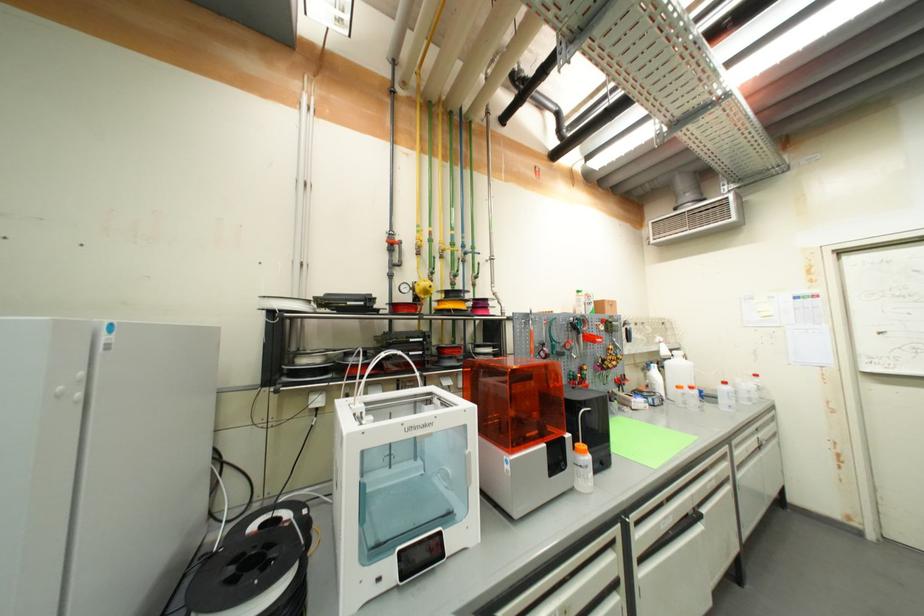
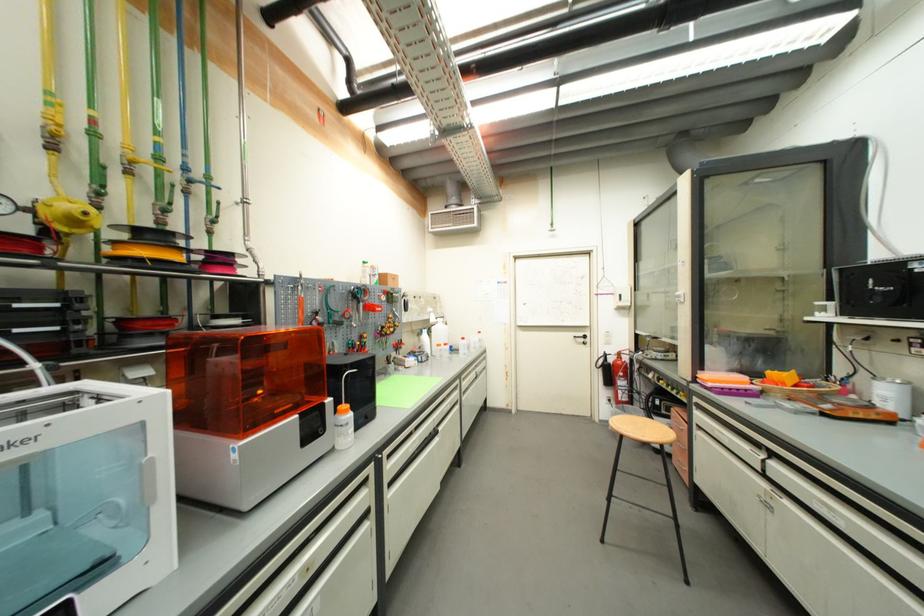
The point at [555,322] is marked in the first image. Where is the corresponding point in the second image?

(334, 289)